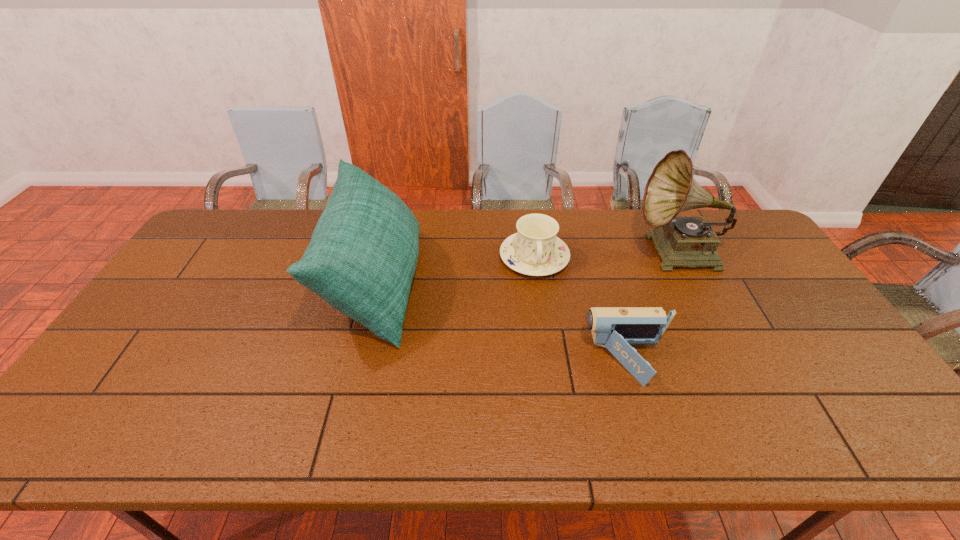
Find the location of a particular element. This screenshot has width=960, height=540. blank area in the image that satisfies the following two spatial constraints: 1. from the horn of the tallest object; 2. on the handle side of the chinaware is located at coordinates (679, 258).

This screenshot has width=960, height=540. What are the coordinates of `vacant space that satisfies the following two spatial constraints: 1. from the horn of the rightmost object; 2. on the handle side of the chinaware` in the screenshot? It's located at (679, 258).

The height and width of the screenshot is (540, 960). What are the coordinates of `blank area in the image that satisfies the following two spatial constraints: 1. from the horn of the tallest object; 2. on the handle side of the chinaware` in the screenshot? It's located at [679, 258].